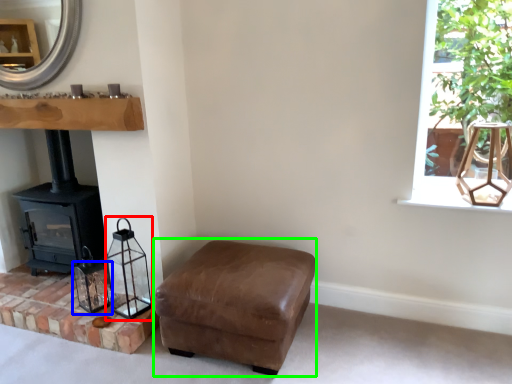
Question: Considering the real-world distances, which object is closest to lamp (highlighted by a red box)? candle holder (highlighted by a blue box) or armchair (highlighted by a green box).

Choices:
 (A) candle holder
 (B) armchair

Answer: (A)